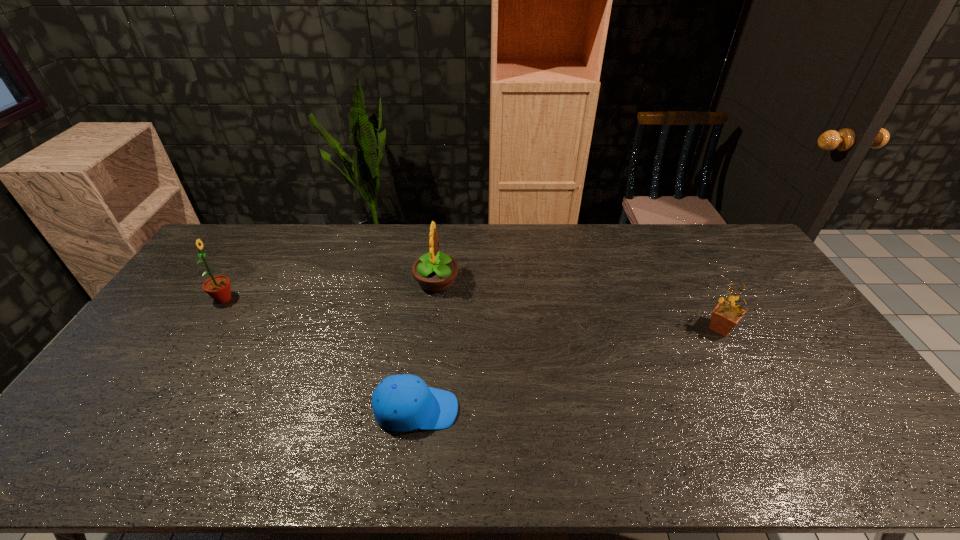
Locate an element on the screen. vacant space located 0.090m at the front of the rightmost sunflower with flowers visible is located at coordinates (675, 328).

Find the location of `vacant space located 0.210m on the front-facing side of the shortest object`. vacant space located 0.210m on the front-facing side of the shortest object is located at coordinates (540, 409).

Locate an element on the screen. object at the left edge is located at coordinates (218, 287).

What are the coordinates of `free space at the far edge of the desktop` in the screenshot? It's located at (419, 252).

Image resolution: width=960 pixels, height=540 pixels. I want to click on blank space at the near edge, so click(565, 439).

In the image, there is a desktop. Identify the location of vacant space at the left edge. (160, 350).

Locate an element on the screen. The image size is (960, 540). vacant space at the right edge of the desktop is located at coordinates (826, 375).

In the image, there is a desktop. Where is `vacant space at the far left corner`? This screenshot has height=540, width=960. vacant space at the far left corner is located at coordinates (228, 227).

In the image, there is a desktop. Where is `vacant area at the far right corner`? This screenshot has height=540, width=960. vacant area at the far right corner is located at coordinates (732, 226).

Locate an element on the screen. free spot between the second sunflower from right to left and the cap is located at coordinates (426, 346).